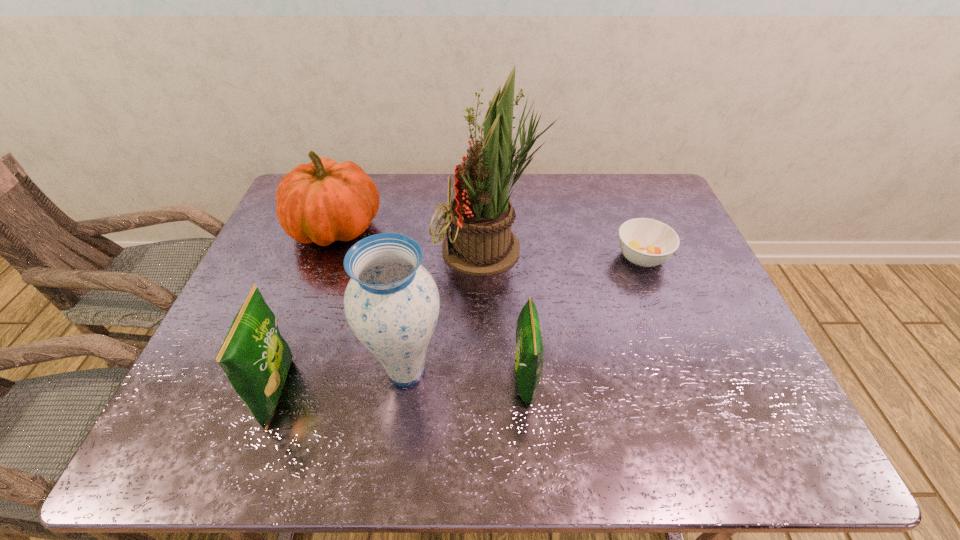
Locate an element on the screen. The height and width of the screenshot is (540, 960). free spot between the soup bowl and the left crisp (potato chip) is located at coordinates (460, 324).

At what (x,y) coordinates should I click in order to perform the action: click on free area in between the vase and the right crisp (potato chip). Please return your answer as a coordinate pair (x, y). The width and height of the screenshot is (960, 540). Looking at the image, I should click on (466, 375).

Locate an element on the screen. object that ranks as the closest to the left crisp (potato chip) is located at coordinates (x=391, y=303).

Identify which object is the closest to the taller crisp (potato chip). Please provide its 2D coordinates. Your answer should be formatted as a tuple, i.e. [(x, y)], where the tuple contains the x and y coordinates of a point satisfying the conditions above.

[(391, 303)]

Where is `free location that satisfies the following two spatial constraints: 1. on the front side of the soup bowl; 2. on the left side of the pumpkin`? Image resolution: width=960 pixels, height=540 pixels. free location that satisfies the following two spatial constraints: 1. on the front side of the soup bowl; 2. on the left side of the pumpkin is located at coordinates (325, 257).